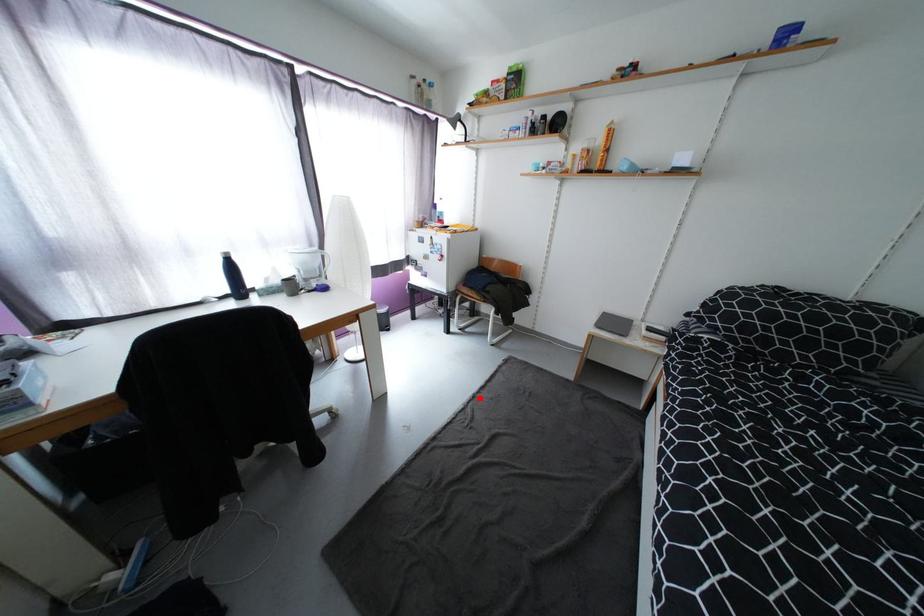
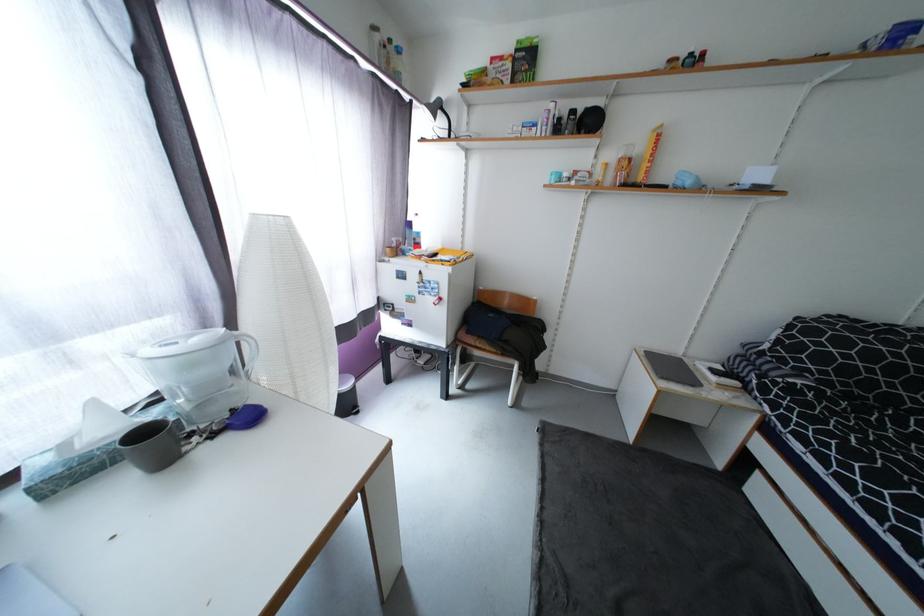
Question: I am providing you with two images of the same scene from different viewpoints. A red point is shown in image1. For the corresponding object point in image2, is it positioned nearer or farther from the camera?

Choices:
 (A) Nearer
 (B) Farther

Answer: (B)